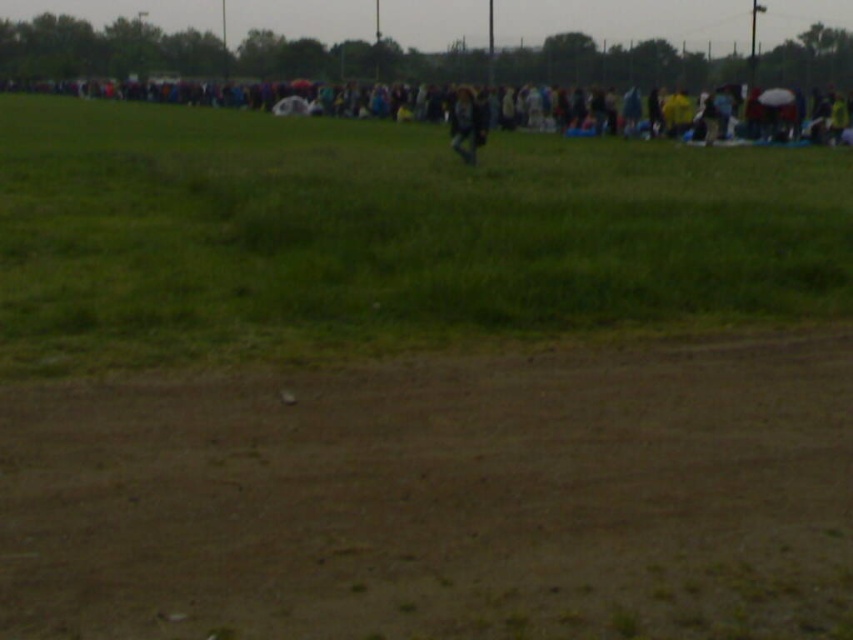
You are a photographer trying to capture the dark blue jacket at center in your shot. The brown dirt field at lower center is blocking part of the jacket. Can you adjust your camera angle to see the entire jacket without moving the jacket itself?

The brown dirt field at lower center is not as tall as the dark blue jacket at center, so lowering the camera angle might allow you to see the entire jacket by positioning the camera closer to the ground level where the dirt field is shorter than the jacket.

You are standing in the outdoor scene described. You need to reach the large gathering of people in the background as quickly as possible. Is the brown dirt field at lower center closer to you than the crowd?

The brown dirt field at lower center is 20.52 feet away from you. Since the crowd is in the background beyond the dirt field, it is farther away. Therefore, the dirt field is closer than the crowd.